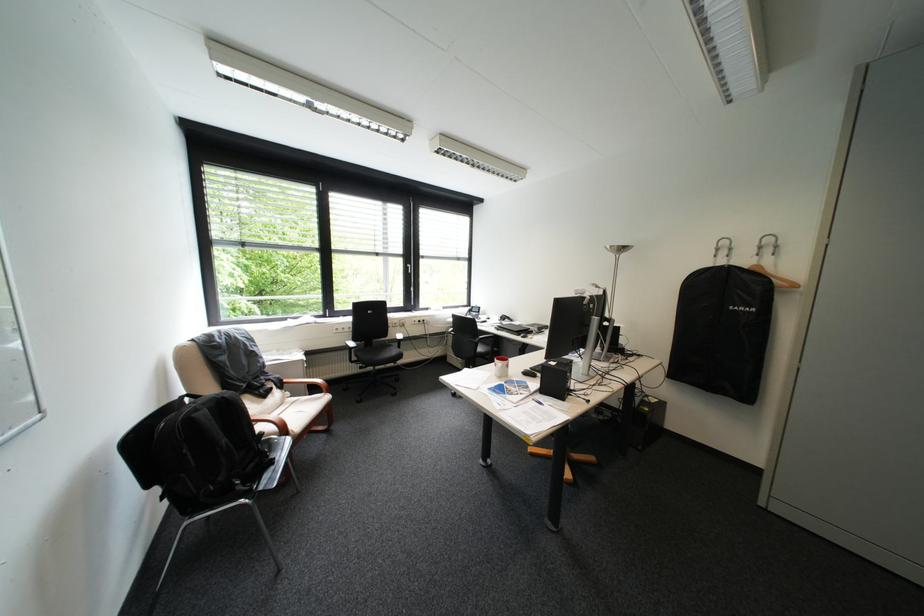
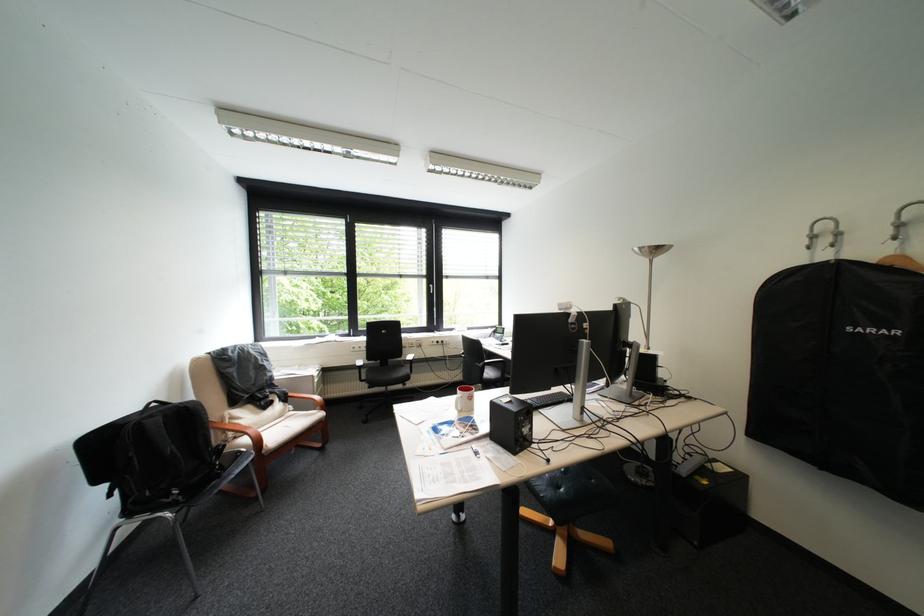
Locate, in the second image, the point that corresponds to (296,430) in the first image.

(271, 443)